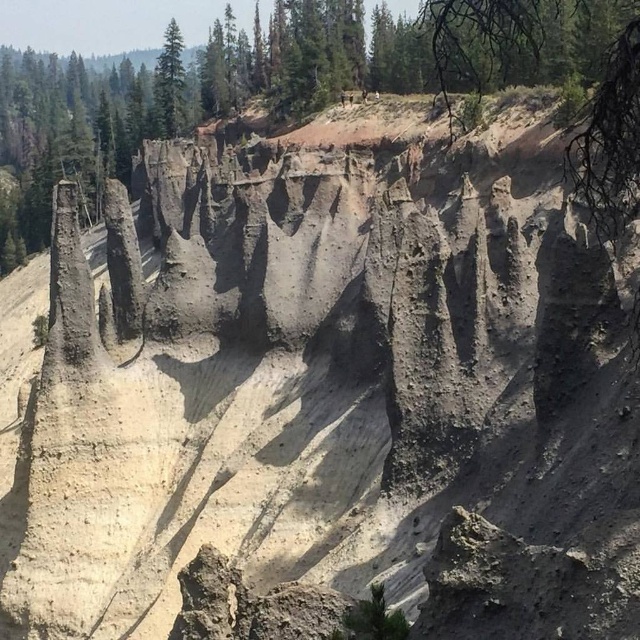
Question: Which point is farther to the camera?

Choices:
 (A) green matte tree at upper center
 (B) dull gray rock formation at center

Answer: (A)

Question: Among these points, which one is nearest to the camera?

Choices:
 (A) (209, 45)
 (B) (168, 35)

Answer: (B)

Question: Is the position of dull gray rock formation at center more distant than that of green matte tree at upper center?

Choices:
 (A) yes
 (B) no

Answer: (B)

Question: Where is dull gray rock formation at center located in relation to green matte tree at upper center in the image?

Choices:
 (A) above
 (B) below

Answer: (B)

Question: Does dull gray rock formation at center appear on the left side of green matte tree at upper center?

Choices:
 (A) yes
 (B) no

Answer: (B)